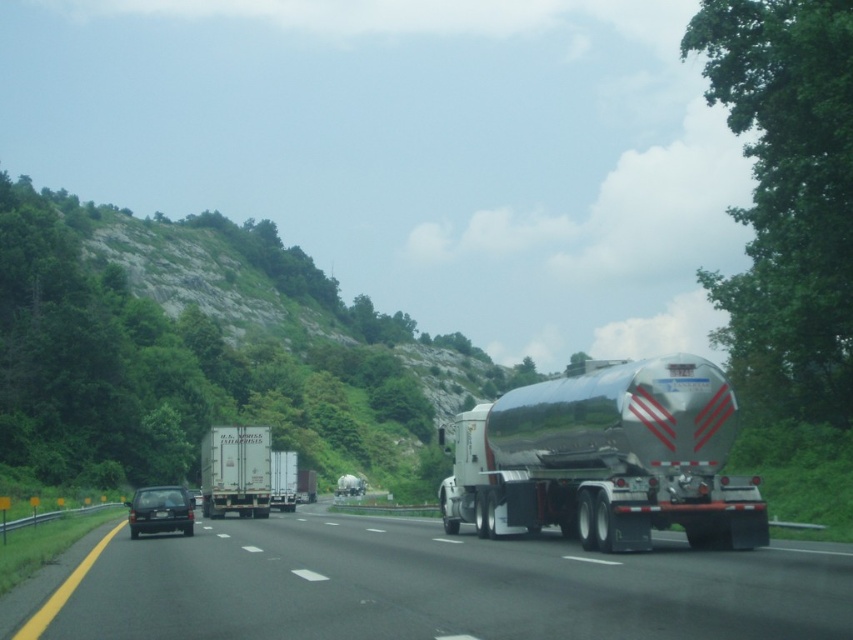
From the picture: You are driving a car and need to navigate around the rocky terrain at upper left and the matte black car at center. Based on their positions, which object is closer to you as you drive forward?

The rocky terrain at upper left is closer to the viewer than the matte black car at center, so you should first navigate around the rocky terrain at upper left before approaching the matte black car at center.

You are a driver approaching a highway with a rocky terrain at upper left and a matte black car at center. Which object is higher in elevation?

The rocky terrain at upper left is taller than the matte black car at center.